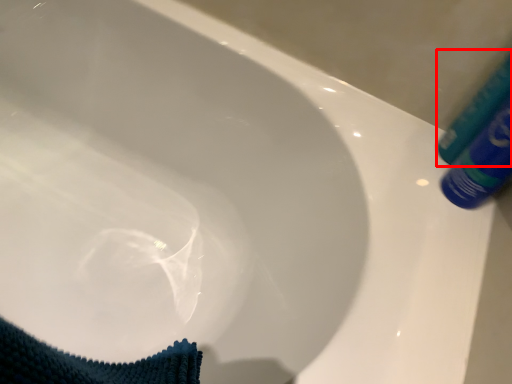
Question: Observing the image, what is the correct spatial positioning of tube (annotated by the red box) in reference to tube?

Choices:
 (A) right
 (B) left

Answer: (A)